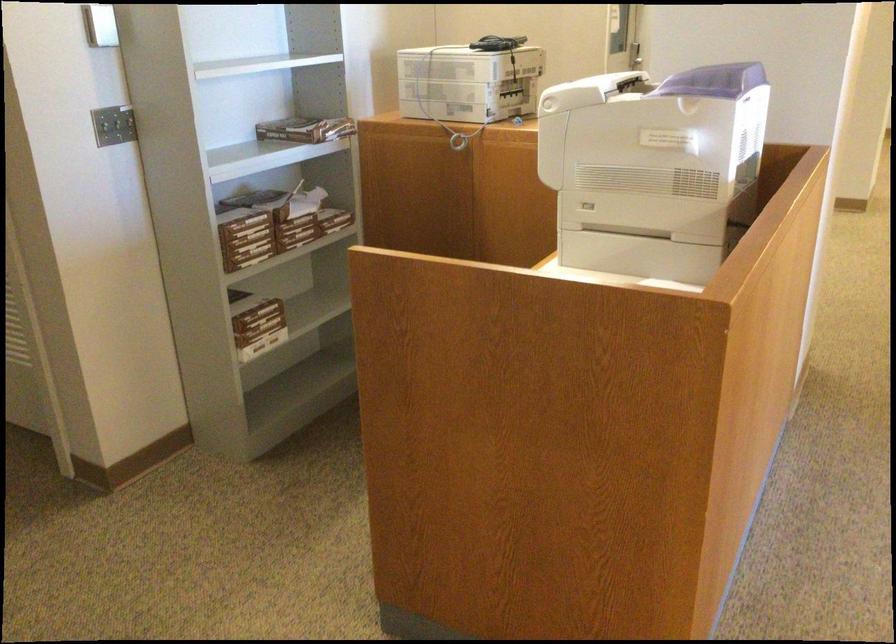
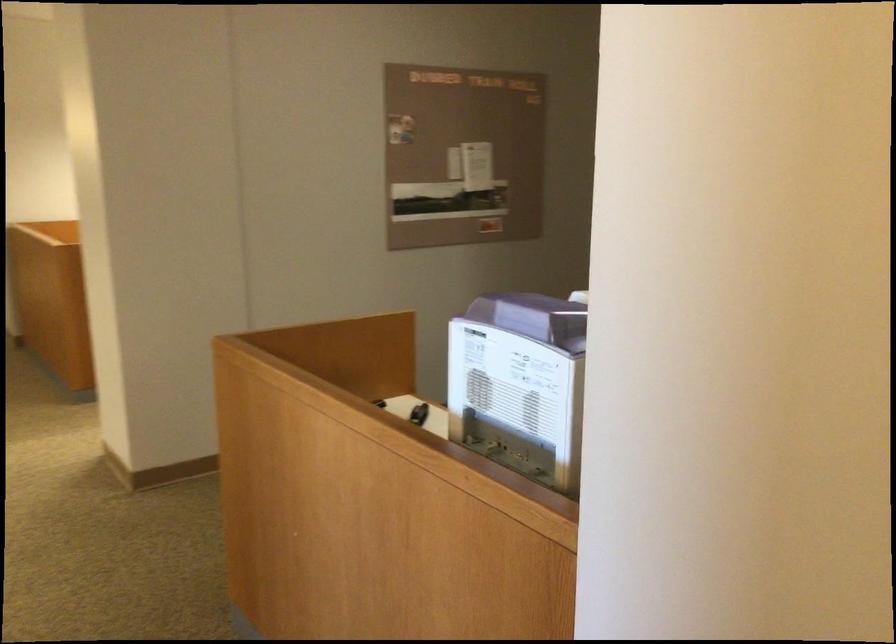
Question: I am providing you with two images of the same scene from different viewpoints. Please identify which objects are invisible in image2.

Choices:
 (A) ream of paper
 (B) colorful folded umbrella
 (C) purple machine lid
 (D) small black object

Answer: (A)